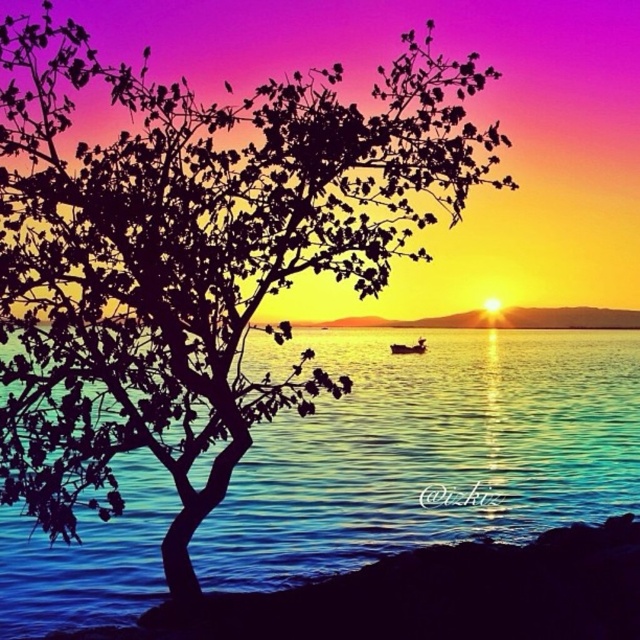
Question: Which point is farther to the camera?

Choices:
 (A) wooden boat at center
 (B) blue liquid water at center

Answer: (B)

Question: Which point is farther to the camera?

Choices:
 (A) (401, 348)
 (B) (456, 380)

Answer: (B)

Question: Can you confirm if blue liquid water at center is smaller than wooden boat at center?

Choices:
 (A) yes
 (B) no

Answer: (B)

Question: Which point is farther to the camera?

Choices:
 (A) (420, 342)
 (B) (268, 477)

Answer: (A)

Question: Does blue liquid water at center appear on the right side of wooden boat at center?

Choices:
 (A) no
 (B) yes

Answer: (A)

Question: Is blue liquid water at center smaller than wooden boat at center?

Choices:
 (A) no
 (B) yes

Answer: (A)